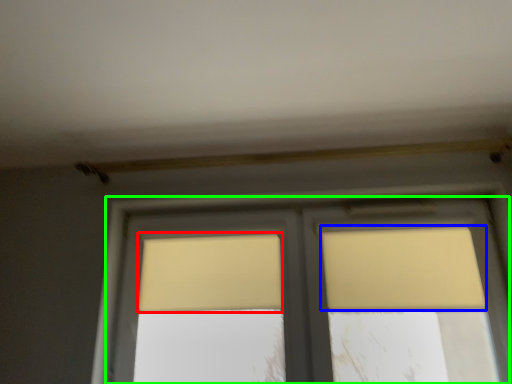
Question: Based on their relative distances, which object is nearer to curtain (highlighted by a red box)? Choose from curtain (highlighted by a blue box) and window (highlighted by a green box).

Choices:
 (A) curtain
 (B) window

Answer: (B)